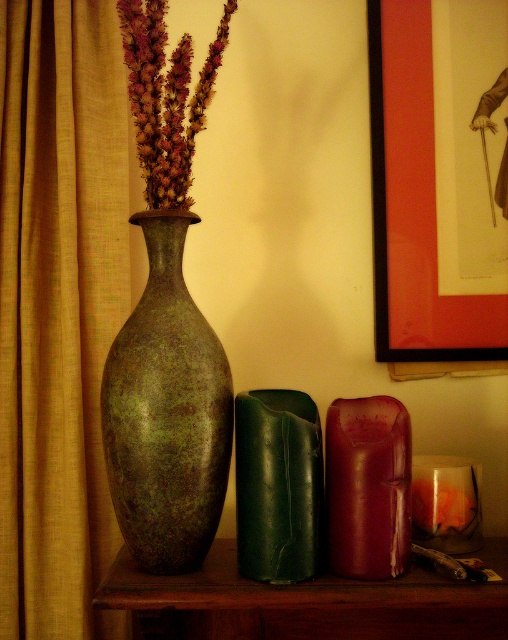
You are arranging a shelf and need to know the spatial relationship between the matte red picture frame at upper right and the purple textured flowers at center. Which one is closer to the viewer?

The purple textured flowers at center is behind the matte red picture frame at upper right, so the matte red picture frame at upper right is closer to the viewer.

You are an interior designer arranging items in a room. You have a new decorative item that needs to be placed exactly at point (414, 204). What object is currently located at that position?

The point (414, 204) corresponds to the matte red picture frame at upper right.

You are arranging a shelf and need to place the matte red picture frame at upper right and the purple textured flowers at center. Based on their positions in the image, which object is closer to the right edge of the shelf?

The matte red picture frame at upper right is closer to the right edge of the shelf because it is positioned to the right of the purple textured flowers at center.